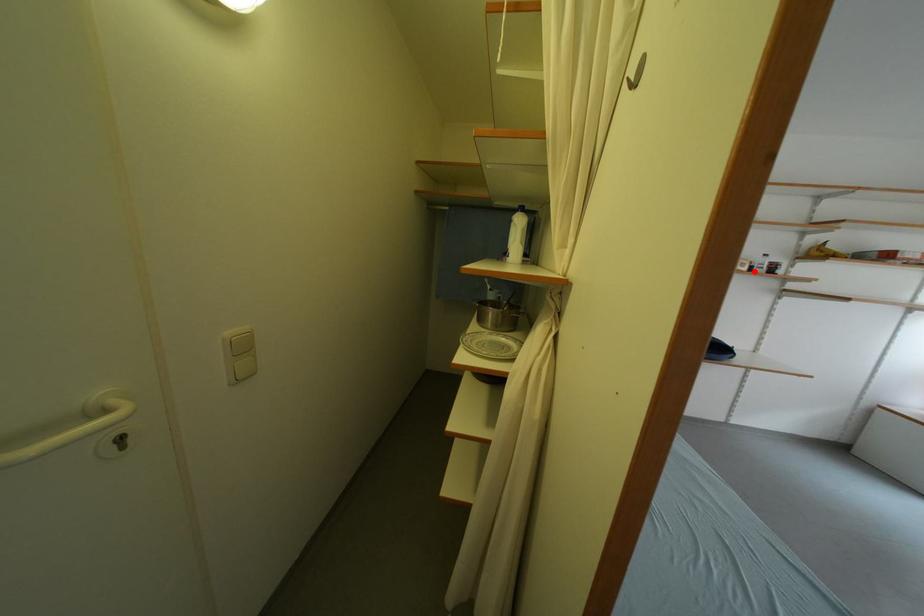
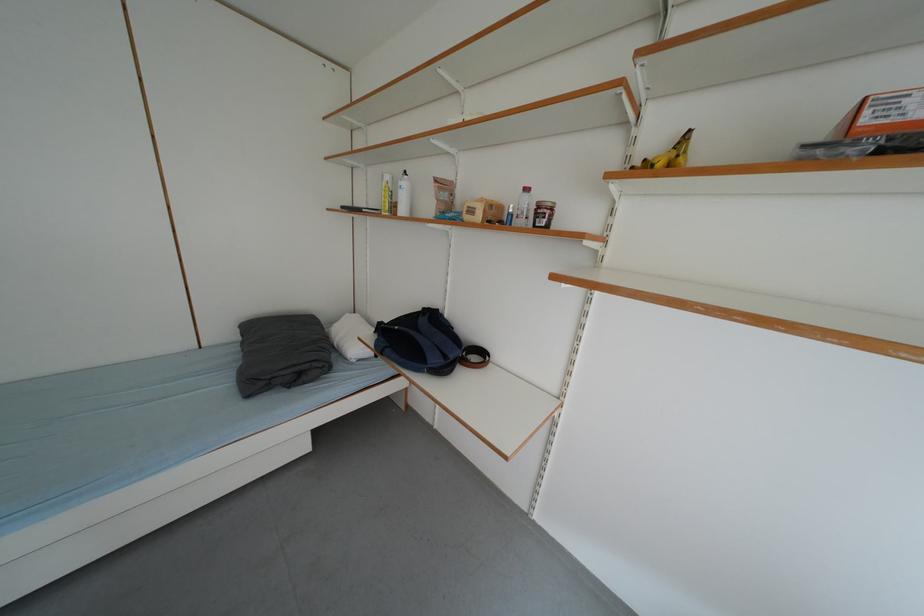
The point at the highlighted location is marked in the first image. Where is the corresponding point in the second image?

(487, 220)